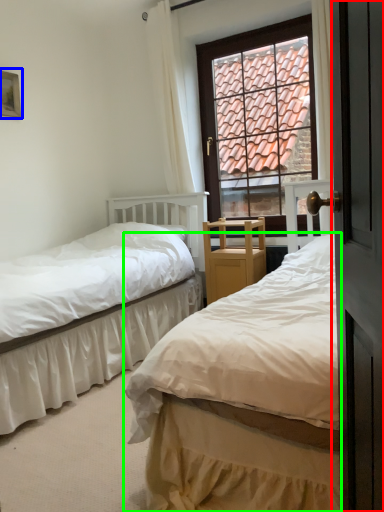
Question: Which is farther away from screen door (highlighted by a red box)? picture frame (highlighted by a blue box) or bed (highlighted by a green box)?

Choices:
 (A) picture frame
 (B) bed

Answer: (A)